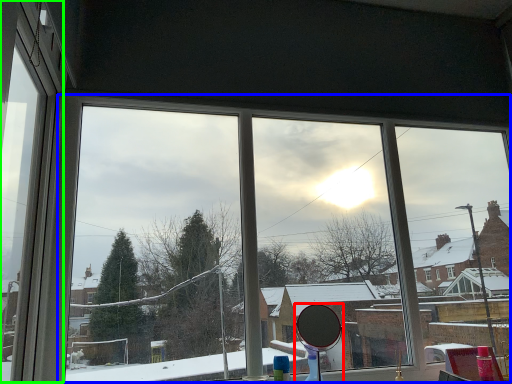
Question: Which is nearer to the mirror (highlighted by a red box)? bay window (highlighted by a blue box) or window frame (highlighted by a green box).

Choices:
 (A) bay window
 (B) window frame

Answer: (A)